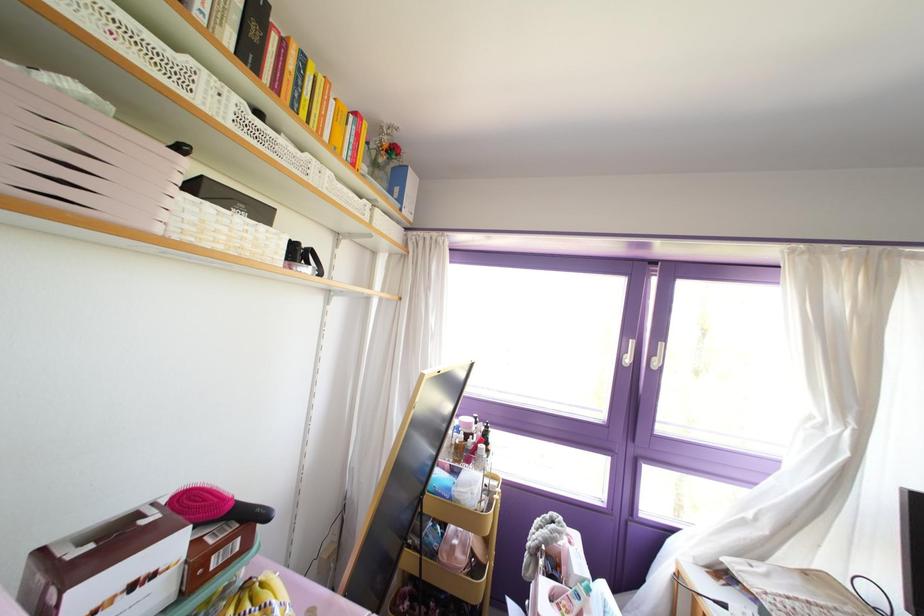
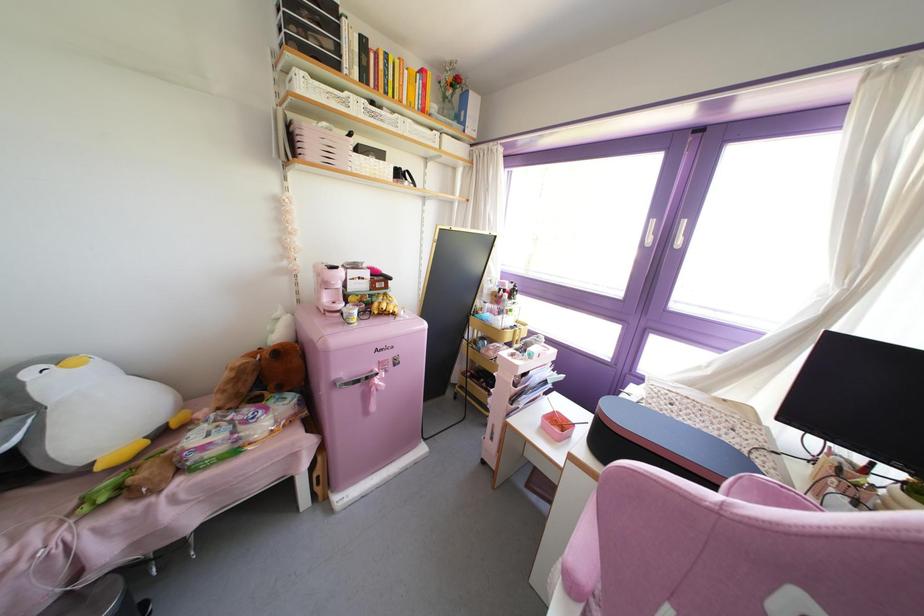
Locate, in the second image, the point that corresponds to point 630,342 in the first image.

(652, 222)